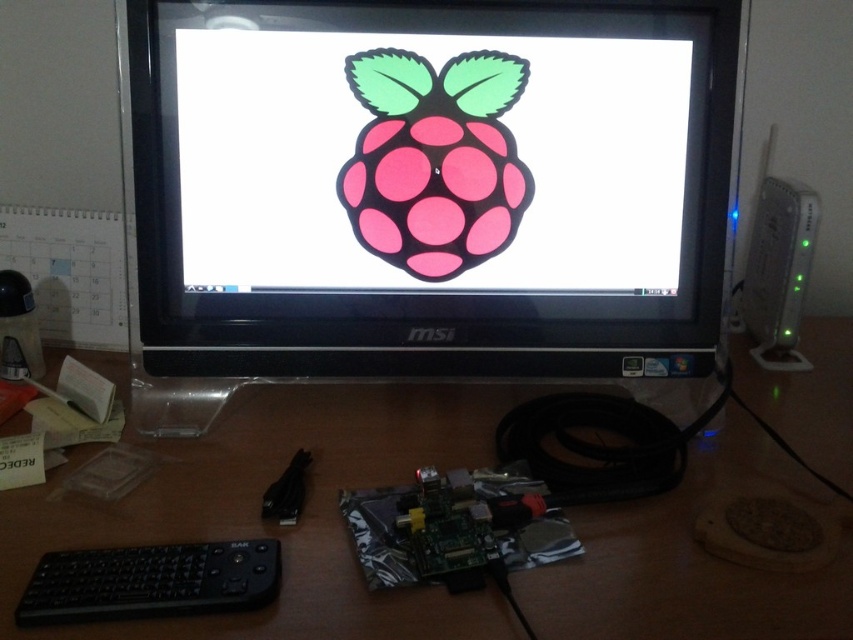
You are a photographer taking a closeup shot of the Raspberry Pi board on the desk. You have two points marked in the image for focus adjustment. The first point is at coordinate point (851, 468) and the second is at point (91, 595). Which point should you focus on to ensure the Raspberry Pi board is in sharp focus?

Point (851, 468) is further to the camera than point (91, 595), so focusing on point (851, 468) will ensure the Raspberry Pi board is in sharp focus.

You are setting up a new workspace and want to place a decorative item between the black plastic monitor at center and the black matte keyboard at lower left. Considering their sizes, which object should be placed closer to the edge of the desk to ensure the decorative item fits comfortably?

The black matte keyboard at lower left is smaller in width than the black plastic monitor at center. To ensure the decorative item fits comfortably, place the black matte keyboard at lower left closer to the edge of the desk since it takes up less space.

You are setting up a new workspace and want to place a decorative plant between the black plastic monitor at center and the wooden at center. Based on the current setup, where should you position the plant?

The black plastic monitor at center is to the left of wooden at center, so the plant should be placed between them in the center area, to the right of the black plastic monitor at center and to the left of the wooden at center.